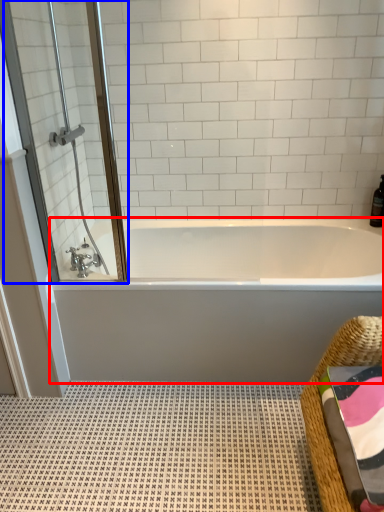
Question: Which object is further to the camera taking this photo, bathtub (highlighted by a red box) or screen door (highlighted by a blue box)?

Choices:
 (A) bathtub
 (B) screen door

Answer: (A)